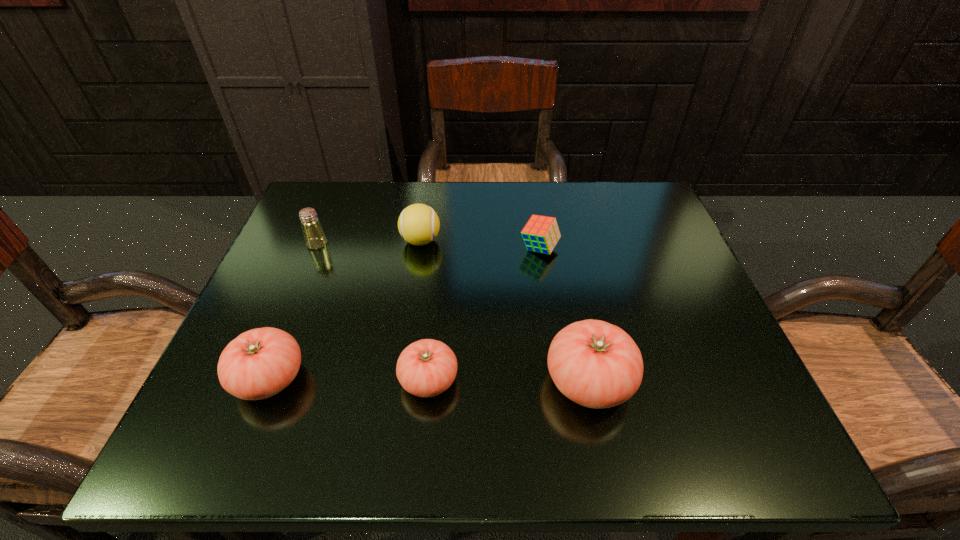
The image size is (960, 540). What are the coordinates of `the leftmost tomato` in the screenshot? It's located at (259, 363).

Where is `the second tomato from left to right`? Image resolution: width=960 pixels, height=540 pixels. the second tomato from left to right is located at coordinates (426, 368).

Find the location of `the rightmost tomato`. the rightmost tomato is located at coordinates (595, 364).

Locate an element on the screen. The width and height of the screenshot is (960, 540). the tallest object is located at coordinates (595, 364).

Find the location of `cube`. cube is located at coordinates (541, 233).

The height and width of the screenshot is (540, 960). I want to click on tennis ball, so click(x=418, y=224).

What are the coordinates of `saltshaker` in the screenshot? It's located at (315, 238).

Locate an element on the screen. vacant space situated on the right of the second shortest tomato is located at coordinates (348, 379).

Where is `vacant space situated on the back of the shortest tomato`? This screenshot has height=540, width=960. vacant space situated on the back of the shortest tomato is located at coordinates (438, 291).

Identify the location of free space located 0.180m on the left of the rightmost tomato. This screenshot has width=960, height=540. (438, 381).